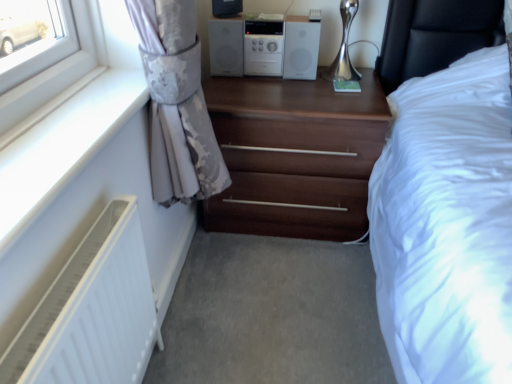
Question: From a real-world perspective, is matte black speaker at upper center under white plastic stereo at upper center?

Choices:
 (A) no
 (B) yes

Answer: (A)

Question: Can you confirm if matte black speaker at upper center is wider than white plastic stereo at upper center?

Choices:
 (A) no
 (B) yes

Answer: (A)

Question: Is white plastic stereo at upper center completely or partially inside matte black speaker at upper center?

Choices:
 (A) yes
 (B) no

Answer: (B)

Question: Is matte black speaker at upper center completely or partially outside of white plastic stereo at upper center?

Choices:
 (A) yes
 (B) no

Answer: (A)

Question: Considering the relative positions of matte black speaker at upper center and white plastic stereo at upper center in the image provided, is matte black speaker at upper center behind white plastic stereo at upper center?

Choices:
 (A) yes
 (B) no

Answer: (B)

Question: Relative to dark wood chest of drawers at center, is white plastic stereo at upper center in front or behind?

Choices:
 (A) behind
 (B) front

Answer: (A)

Question: From a real-world perspective, relative to dark wood chest of drawers at center, is white plastic stereo at upper center vertically above or below?

Choices:
 (A) above
 (B) below

Answer: (A)

Question: Is white plastic stereo at upper center taller or shorter than dark wood chest of drawers at center?

Choices:
 (A) short
 (B) tall

Answer: (A)

Question: Based on their positions, is white plastic stereo at upper center located to the left or right of dark wood chest of drawers at center?

Choices:
 (A) right
 (B) left

Answer: (B)

Question: Is white matte radiator at lower left inside or outside of white plastic stereo at upper center?

Choices:
 (A) outside
 (B) inside

Answer: (A)

Question: From their relative heights in the image, would you say white matte radiator at lower left is taller or shorter than white plastic stereo at upper center?

Choices:
 (A) short
 (B) tall

Answer: (B)

Question: From a real-world perspective, is white matte radiator at lower left physically located above or below white plastic stereo at upper center?

Choices:
 (A) below
 (B) above

Answer: (A)

Question: In terms of width, does white matte radiator at lower left look wider or thinner when compared to white plastic stereo at upper center?

Choices:
 (A) thin
 (B) wide

Answer: (A)

Question: From the image's perspective, is dark wood chest of drawers at center positioned above or below white matte radiator at lower left?

Choices:
 (A) below
 (B) above

Answer: (B)

Question: Considering the relative positions of dark wood chest of drawers at center and white matte radiator at lower left in the image provided, is dark wood chest of drawers at center to the left or to the right of white matte radiator at lower left?

Choices:
 (A) right
 (B) left

Answer: (A)